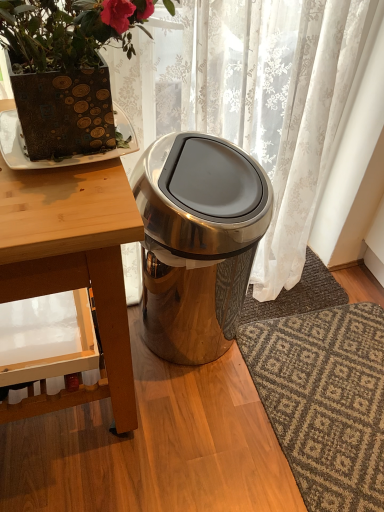
Question: Does dark gray textured rug at lower right, which ranks as the second doormat in bottom-to-top order, contain wooden table at left?

Choices:
 (A) yes
 (B) no

Answer: (B)

Question: Is dark gray textured rug at lower right, the first doormat when ordered from top to bottom, facing towards wooden table at left?

Choices:
 (A) yes
 (B) no

Answer: (B)

Question: Considering the relative sizes of dark gray textured rug at lower right, the first doormat when ordered from top to bottom, and wooden table at left in the image provided, is dark gray textured rug at lower right, the first doormat when ordered from top to bottom, shorter than wooden table at left?

Choices:
 (A) no
 (B) yes

Answer: (B)

Question: Can you see dark gray textured rug at lower right, the first doormat when ordered from top to bottom, touching wooden table at left?

Choices:
 (A) no
 (B) yes

Answer: (A)

Question: Is dark gray textured rug at lower right, which ranks as the second doormat in bottom-to-top order, bigger than wooden table at left?

Choices:
 (A) yes
 (B) no

Answer: (B)

Question: Does point (271, 373) appear closer or farther from the camera than point (112, 272)?

Choices:
 (A) farther
 (B) closer

Answer: (A)

Question: From a real-world perspective, is brown textured rug at lower right, placed as the 2th doormat when sorted from top to bottom, above or below wooden table at left?

Choices:
 (A) above
 (B) below

Answer: (B)

Question: Is brown textured rug at lower right, placed as the 2th doormat when sorted from top to bottom, wider or thinner than wooden table at left?

Choices:
 (A) wide
 (B) thin

Answer: (A)

Question: Based on their sizes in the image, would you say brown textured rug at lower right, placed as the 2th doormat when sorted from top to bottom, is bigger or smaller than wooden table at left?

Choices:
 (A) small
 (B) big

Answer: (A)

Question: From a real-world perspective, is brown textured plate at upper left physically located above or below matte brown pot at upper left?

Choices:
 (A) below
 (B) above

Answer: (A)

Question: In terms of height, does brown textured plate at upper left look taller or shorter compared to matte brown pot at upper left?

Choices:
 (A) tall
 (B) short

Answer: (B)

Question: Looking at the image, does brown textured plate at upper left seem bigger or smaller compared to matte brown pot at upper left?

Choices:
 (A) big
 (B) small

Answer: (B)

Question: Is brown textured plate at upper left spatially inside matte brown pot at upper left, or outside of it?

Choices:
 (A) outside
 (B) inside

Answer: (A)

Question: Is brown textured rug at lower right, the first doormat positioned from the bottom, taller or shorter than satin silver trash can at center?

Choices:
 (A) short
 (B) tall

Answer: (A)

Question: Is brown textured rug at lower right, placed as the 2th doormat when sorted from top to bottom, to the left or to the right of satin silver trash can at center in the image?

Choices:
 (A) left
 (B) right

Answer: (B)